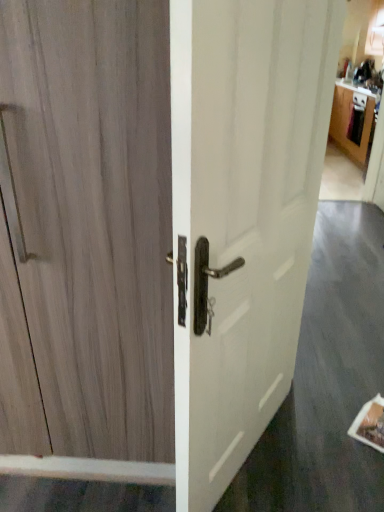
At what (x,y) coordinates should I click in order to perform the action: click on light brown wood door at left. Please return your answer as a coordinate pair (x, y). This screenshot has height=512, width=384. Looking at the image, I should click on (95, 216).

In order to click on white glossy door handle at center in this screenshot , I will do `click(253, 211)`.

Would you say wooden cabinet at upper right contains light brown wood door at left?

No.

Is point (333, 118) in front of point (108, 342)?

That is False.

Which is more to the right, wooden cabinet at upper right or light brown wood door at left?

wooden cabinet at upper right.

Where is `screen door that appears below the wooden cabinet at upper right (from the image's perspective)`? The image size is (384, 512). screen door that appears below the wooden cabinet at upper right (from the image's perspective) is located at coordinates (253, 211).

Would you say white glossy door handle at center is a long distance from wooden cabinet at upper right?

Yes, white glossy door handle at center is far from wooden cabinet at upper right.

Is wooden cabinet at upper right surrounded by white glossy door handle at center?

Definitely not — wooden cabinet at upper right is not inside white glossy door handle at center.

Which of these two, white glossy door handle at center or wooden cabinet at upper right, is bigger?

Bigger between the two is wooden cabinet at upper right.

From a real-world perspective, between light brown wood door at left and wooden cabinet at upper right, who is vertically higher?

light brown wood door at left.

Could you tell me if light brown wood door at left is turned towards wooden cabinet at upper right?

No, light brown wood door at left is not aimed at wooden cabinet at upper right.

Which object is more forward, light brown wood door at left or wooden cabinet at upper right?

light brown wood door at left is in front.

Which object is further away from the camera taking this photo, wooden cabinet at upper right or white glossy door handle at center?

wooden cabinet at upper right is more distant.

From a real-world perspective, is wooden cabinet at upper right physically below white glossy door handle at center?

Yes, from a real-world perspective, wooden cabinet at upper right is below white glossy door handle at center.

Does wooden cabinet at upper right have a greater height compared to white glossy door handle at center?

No.

From the image's perspective, is wooden cabinet at upper right located above or below white glossy door handle at center?

Clearly, from the image's perspective, wooden cabinet at upper right is above white glossy door handle at center.

Is light brown wood door at left looking in the opposite direction of white glossy door handle at center?

No, light brown wood door at left's orientation is not away from white glossy door handle at center.

Is light brown wood door at left wider than white glossy door handle at center?

In fact, light brown wood door at left might be narrower than white glossy door handle at center.

Looking at this image, does light brown wood door at left lie behind white glossy door handle at center?

Yes, light brown wood door at left is further from the camera.

In the image, is white glossy door handle at center positioned in front of or behind light brown wood door at left?

In the image, white glossy door handle at center appears in front of light brown wood door at left.

From the image's perspective, is white glossy door handle at center on top of light brown wood door at left?

Yes, from the image's perspective, white glossy door handle at center is over light brown wood door at left.

Is white glossy door handle at center wider or thinner than light brown wood door at left?

Considering their sizes, white glossy door handle at center looks broader than light brown wood door at left.

Based on the photo, is white glossy door handle at center completely or partially outside of light brown wood door at left?

Absolutely, white glossy door handle at center is external to light brown wood door at left.

Find the location of `door below the wooden cabinet at upper right (from the image's perspective)`. door below the wooden cabinet at upper right (from the image's perspective) is located at coordinates (95, 216).

Locate an element on the screen. screen door above the wooden cabinet at upper right (from a real-world perspective) is located at coordinates (253, 211).

Based on their spatial positions, is wooden cabinet at upper right or light brown wood door at left closer to white glossy door handle at center?

light brown wood door at left.

Based on their spatial positions, is light brown wood door at left or white glossy door handle at center closer to wooden cabinet at upper right?

white glossy door handle at center is closer to wooden cabinet at upper right.

Based on their spatial positions, is white glossy door handle at center or light brown wood door at left further from wooden cabinet at upper right?

Among the two, light brown wood door at left is located further to wooden cabinet at upper right.

Estimate the real-world distances between objects in this image. Which object is further from light brown wood door at left, white glossy door handle at center or wooden cabinet at upper right?

wooden cabinet at upper right is further to light brown wood door at left.

Looking at the image, which one is located further to light brown wood door at left, wooden cabinet at upper right or white glossy door handle at center?

wooden cabinet at upper right is positioned further to the anchor light brown wood door at left.

When comparing their distances from white glossy door handle at center, does light brown wood door at left or wooden cabinet at upper right seem closer?

light brown wood door at left lies closer to white glossy door handle at center than the other object.

The image size is (384, 512). Identify the location of door between white glossy door handle at center and wooden cabinet at upper right along the z-axis. (95, 216).